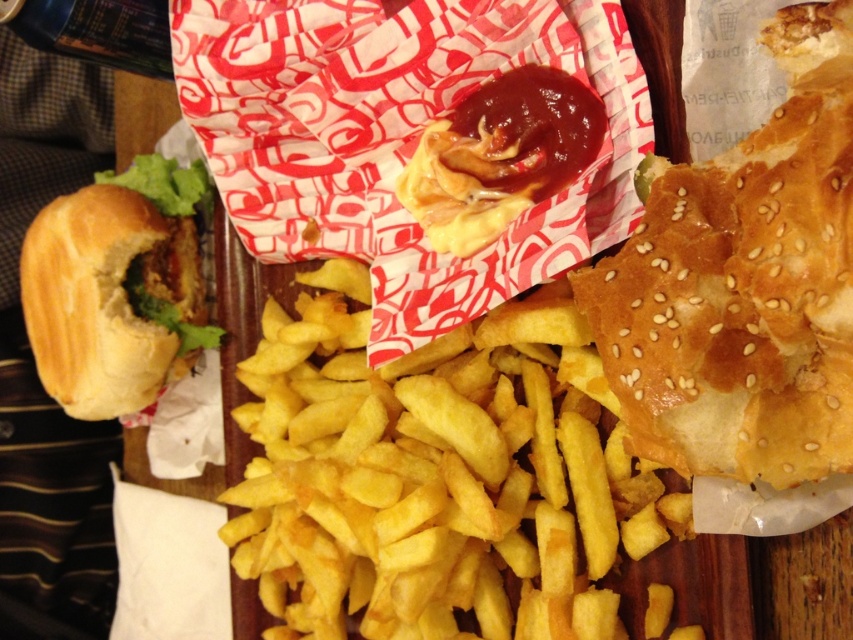
Question: Which of the following is the farthest from the observer?

Choices:
 (A) slightly toasted bun with lettuce at left
 (B) sesame seed bun at right
 (C) golden crispy french fries at center

Answer: (A)

Question: From the image, what is the correct spatial relationship of golden crispy french fries at center in relation to sesame seed bun at right?

Choices:
 (A) right
 (B) left

Answer: (B)

Question: Which point is farther to the camera?

Choices:
 (A) (695, 422)
 (B) (53, 301)

Answer: (B)

Question: Is the position of golden crispy french fries at center less distant than that of slightly toasted bun with lettuce at left?

Choices:
 (A) no
 (B) yes

Answer: (B)

Question: Is golden crispy french fries at center below slightly toasted bun with lettuce at left?

Choices:
 (A) yes
 (B) no

Answer: (A)

Question: Which object is the farthest from the sesame seed bun at right?

Choices:
 (A) slightly toasted bun with lettuce at left
 (B) golden crispy french fries at center

Answer: (A)